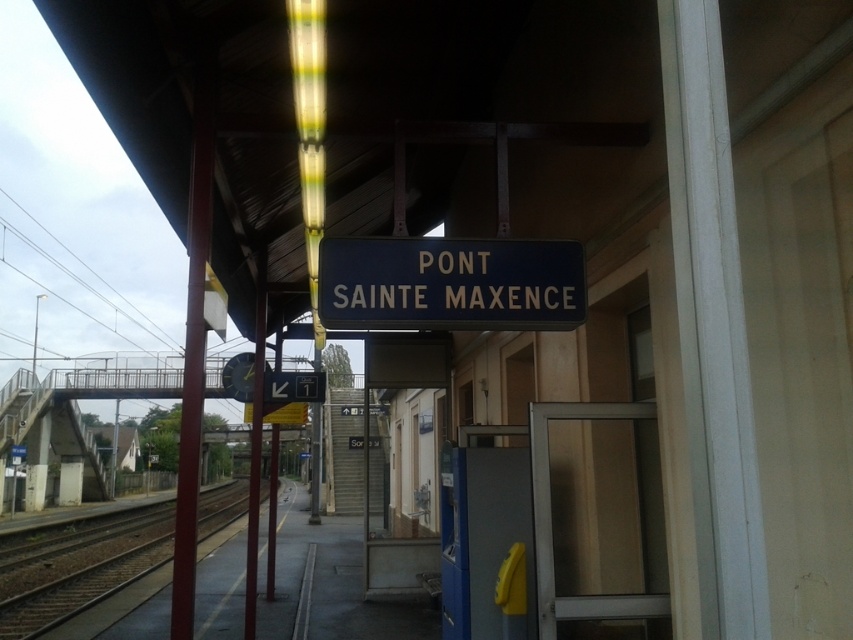
Is point (350, 259) closer to camera compared to point (68, 588)?

Yes, point (350, 259) is in front of point (68, 588).

Does point (488, 320) lie behind point (67, 614)?

No, it is not.

You are a GUI agent. You are given a task and a screenshot of the screen. Output one action in this format:
    pyautogui.click(x=<x>, y=<y>)
    Task: Click on the blue metallic sign at center
    Image resolution: width=853 pixels, height=640 pixels.
    Given the screenshot: What is the action you would take?
    pyautogui.click(x=450, y=284)